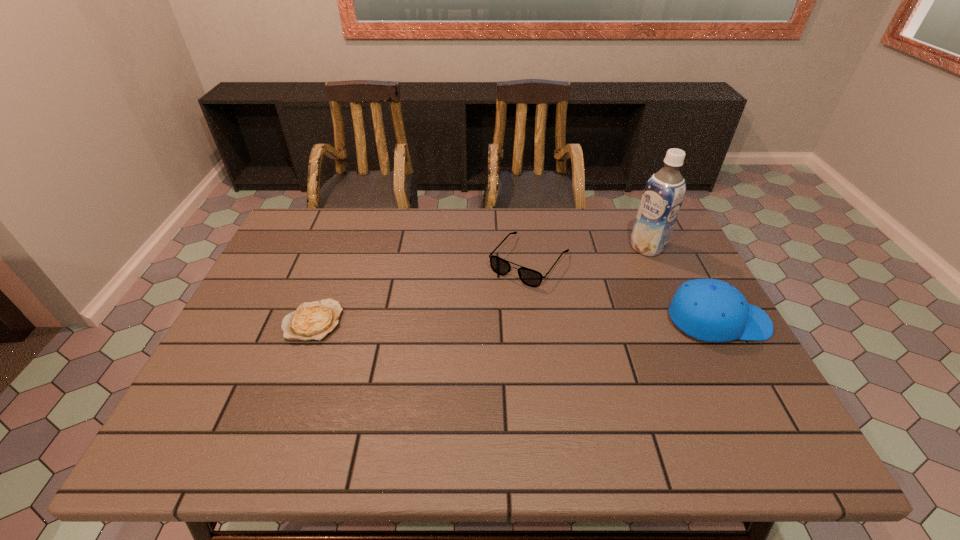
This screenshot has height=540, width=960. I want to click on vacant point located between the soya milk and the third tallest object, so click(x=588, y=254).

Locate an element on the screen. vacant area between the quiche and the soya milk is located at coordinates (480, 284).

Image resolution: width=960 pixels, height=540 pixels. In order to click on vacant space that is in between the shortest object and the cap in this screenshot , I will do pos(516,321).

What are the coordinates of `free space between the cap and the quiche` in the screenshot? It's located at (516, 321).

Identify which object is the second nearest to the second object from left to right. Please provide its 2D coordinates. Your answer should be formatted as a tuple, i.e. [(x, y)], where the tuple contains the x and y coordinates of a point satisfying the conditions above.

[(711, 310)]

Select which object appears as the third closest to the spectacles. Please provide its 2D coordinates. Your answer should be formatted as a tuple, i.e. [(x, y)], where the tuple contains the x and y coordinates of a point satisfying the conditions above.

[(314, 320)]

The height and width of the screenshot is (540, 960). In order to click on vacant space that satisfies the following two spatial constraints: 1. on the front side of the cap; 2. on the front-facing side of the soya milk in this screenshot , I will do `click(681, 321)`.

You are a GUI agent. You are given a task and a screenshot of the screen. Output one action in this format:
    pyautogui.click(x=<x>, y=<y>)
    Task: Click on the vacant area that satisfies the following two spatial constraints: 1. on the front side of the cap; 2. on the front-facing side of the second shortest object
    This screenshot has height=540, width=960.
    Given the screenshot: What is the action you would take?
    pyautogui.click(x=537, y=321)

Locate an element on the screen. free space that satisfies the following two spatial constraints: 1. on the back side of the second object from left to right; 2. on the right side of the tallest object is located at coordinates (527, 247).

Locate an element on the screen. free space in the image that satisfies the following two spatial constraints: 1. on the back side of the third shortest object; 2. on the front-facing side of the quiche is located at coordinates (313, 321).